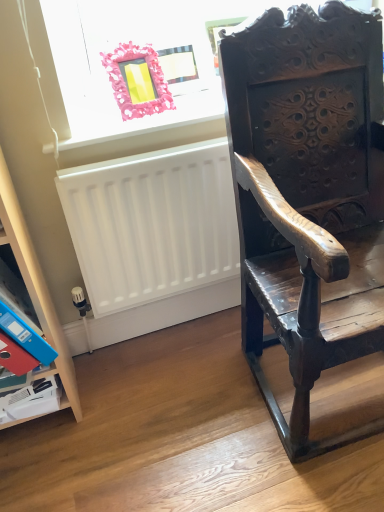
You are a GUI agent. You are given a task and a screenshot of the screen. Output one action in this format:
    pyautogui.click(x=<x>, y=<y>)
    Task: Click on the free point below dark wood carved chair at right (from a real-world perspective)
    The image size is (384, 512).
    Given the screenshot: What is the action you would take?
    pyautogui.click(x=335, y=393)